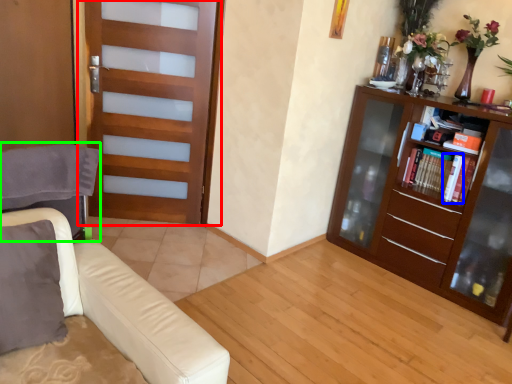
Question: Considering the real-world distances, which object is farthest from door (highlighted by a red box)? book (highlighted by a blue box) or swivel chair (highlighted by a green box)?

Choices:
 (A) book
 (B) swivel chair

Answer: (A)